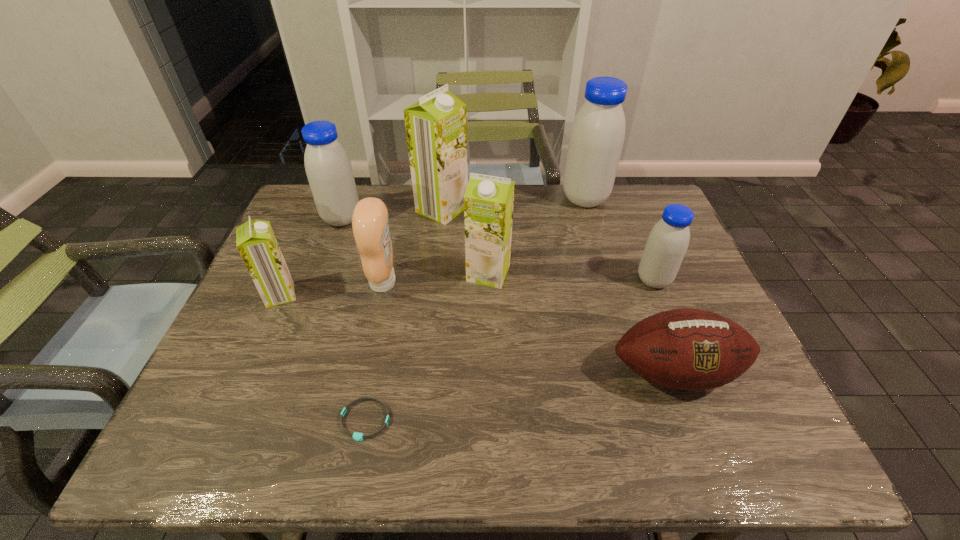
At what (x,y) coordinates should I click in order to perform the action: click on brown football (American). Please return your answer as a coordinate pair (x, y). The image size is (960, 540). Looking at the image, I should click on (687, 349).

Where is `wristband`? The image size is (960, 540). wristband is located at coordinates (356, 436).

Identify the location of gray wristband. (356, 436).

This screenshot has width=960, height=540. I want to click on free space located on the left of the biggest blue soya milk, so click(x=527, y=199).

You are a GUI agent. You are given a task and a screenshot of the screen. Output one action in this format:
    pyautogui.click(x=<x>, y=<y>)
    Task: Click on the vacant region located on the left of the biggest green soya milk
    This screenshot has height=540, width=960.
    Given the screenshot: What is the action you would take?
    pyautogui.click(x=324, y=209)

Where is `vacant region located on the back of the fourth soya milk from left to right`? This screenshot has width=960, height=540. vacant region located on the back of the fourth soya milk from left to right is located at coordinates [x=488, y=228].

I want to click on free location located on the front of the leftmost blue soya milk, so click(x=306, y=315).

This screenshot has width=960, height=540. Identify the location of vacant area located on the label of the condiment. (500, 282).

Where is `vacant space located on the left of the smallest blue soya milk`? vacant space located on the left of the smallest blue soya milk is located at coordinates (516, 280).

What are the coordinates of `vacant space located 0.360m on the front of the leftmost green soya milk` in the screenshot? It's located at (211, 448).